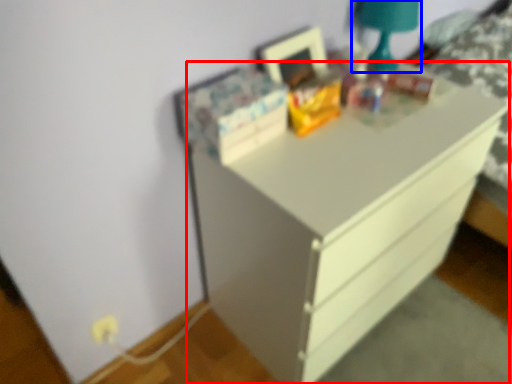
Question: Among these objects, which one is nearest to the camera, chest of drawers (highlighted by a red box) or bedside lamp (highlighted by a blue box)?

Choices:
 (A) chest of drawers
 (B) bedside lamp

Answer: (A)